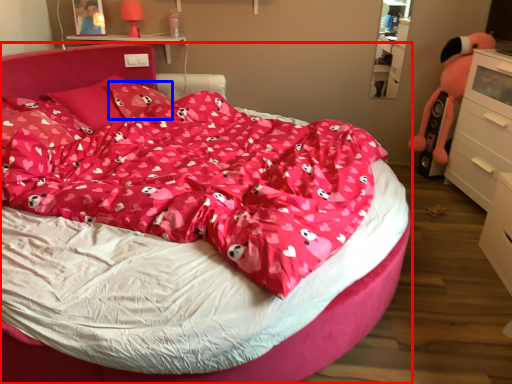
Question: Among these objects, which one is farthest to the camera, bed (highlighted by a red box) or pillow (highlighted by a blue box)?

Choices:
 (A) bed
 (B) pillow

Answer: (B)